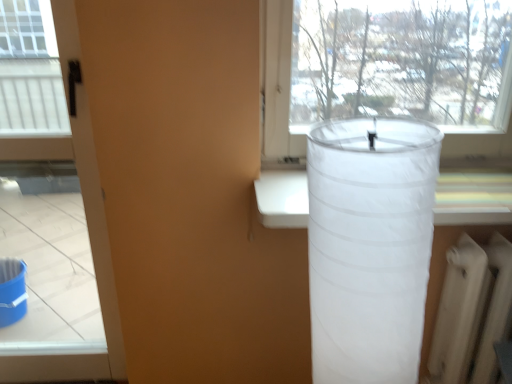
Question: Considering the relative positions of matte black screen door at left and transparent fabric lampshade at right in the image provided, is matte black screen door at left in front of transparent fabric lampshade at right?

Choices:
 (A) no
 (B) yes

Answer: (A)

Question: Considering the relative sizes of matte black screen door at left and transparent fabric lampshade at right in the image provided, is matte black screen door at left smaller than transparent fabric lampshade at right?

Choices:
 (A) no
 (B) yes

Answer: (A)

Question: Is matte black screen door at left taller than transparent fabric lampshade at right?

Choices:
 (A) yes
 (B) no

Answer: (A)

Question: Considering the relative sizes of matte black screen door at left and transparent fabric lampshade at right in the image provided, is matte black screen door at left shorter than transparent fabric lampshade at right?

Choices:
 (A) yes
 (B) no

Answer: (B)

Question: From the image's perspective, is matte black screen door at left on transparent fabric lampshade at right?

Choices:
 (A) yes
 (B) no

Answer: (A)

Question: Can you confirm if matte black screen door at left is wider than transparent fabric lampshade at right?

Choices:
 (A) no
 (B) yes

Answer: (A)

Question: Is transparent fabric lampshade at right thinner than white matte radiator at lower right?

Choices:
 (A) yes
 (B) no

Answer: (B)

Question: Is transparent fabric lampshade at right taller than white matte radiator at lower right?

Choices:
 (A) yes
 (B) no

Answer: (A)

Question: From the image's perspective, does transparent fabric lampshade at right appear lower than white matte radiator at lower right?

Choices:
 (A) no
 (B) yes

Answer: (A)

Question: Is transparent fabric lampshade at right not near white matte radiator at lower right?

Choices:
 (A) no
 (B) yes

Answer: (A)

Question: Considering the relative sizes of transparent fabric lampshade at right and white matte radiator at lower right in the image provided, is transparent fabric lampshade at right smaller than white matte radiator at lower right?

Choices:
 (A) yes
 (B) no

Answer: (B)

Question: Considering the relative sizes of transparent fabric lampshade at right and white matte radiator at lower right in the image provided, is transparent fabric lampshade at right bigger than white matte radiator at lower right?

Choices:
 (A) yes
 (B) no

Answer: (A)

Question: Does white matte radiator at lower right appear on the left side of transparent fabric lampshade at right?

Choices:
 (A) no
 (B) yes

Answer: (A)